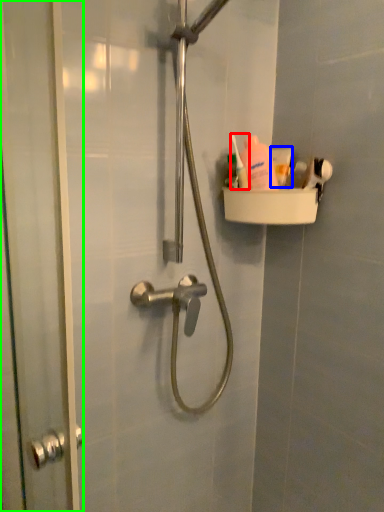
Question: Based on their relative distances, which object is nearer to toiletry (highlighted by a red box)? Choose from toothpaste (highlighted by a blue box) and screen door (highlighted by a green box).

Choices:
 (A) toothpaste
 (B) screen door

Answer: (A)